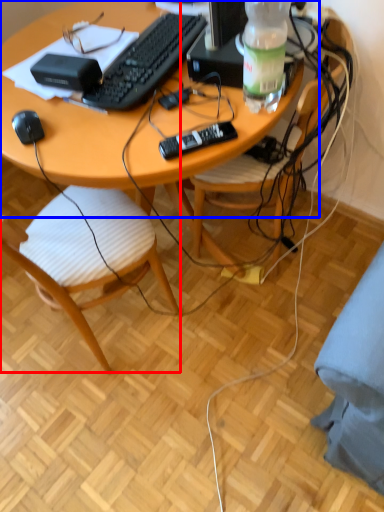
Question: Which object is closer to the camera taking this photo, chair (highlighted by a red box) or desk (highlighted by a blue box)?

Choices:
 (A) chair
 (B) desk

Answer: (A)